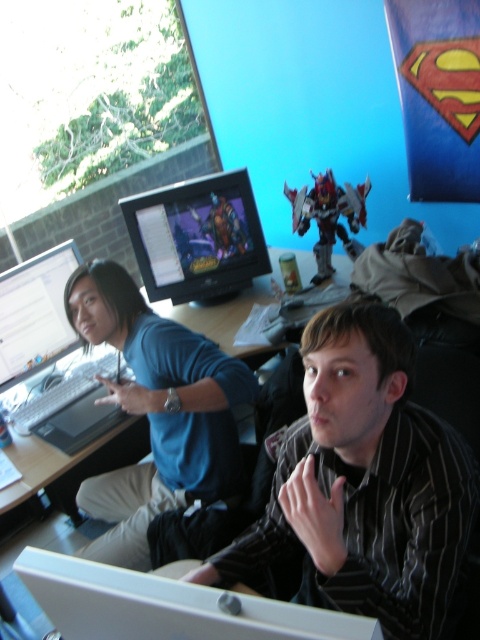
Can you confirm if matte blue shirt at left is thinner than matte black monitor at center?

No.

Consider the image. Who is more distant from viewer, (x=93, y=499) or (x=214, y=264)?

Positioned behind is point (x=214, y=264).

The height and width of the screenshot is (640, 480). I want to click on matte blue shirt at left, so click(x=156, y=412).

Image resolution: width=480 pixels, height=640 pixels. What do you see at coordinates (364, 483) in the screenshot? I see `striped shirt at center` at bounding box center [364, 483].

Who is higher up, striped shirt at center or matte black monitor at left?

matte black monitor at left is higher up.

Which is behind, point (421, 580) or point (13, 342)?

Point (13, 342)

I want to click on striped shirt at center, so click(x=364, y=483).

Is matte black monitor at left thinner than metallic silver robot at center?

Correct, matte black monitor at left's width is less than metallic silver robot at center's.

Between matte black monitor at left and metallic silver robot at center, which one is positioned lower?

Positioned lower is matte black monitor at left.

Is point (39, 364) positioned after point (313, 252)?

That is False.

Find the location of a particular element. This screenshot has width=480, height=640. matte black monitor at left is located at coordinates (35, 314).